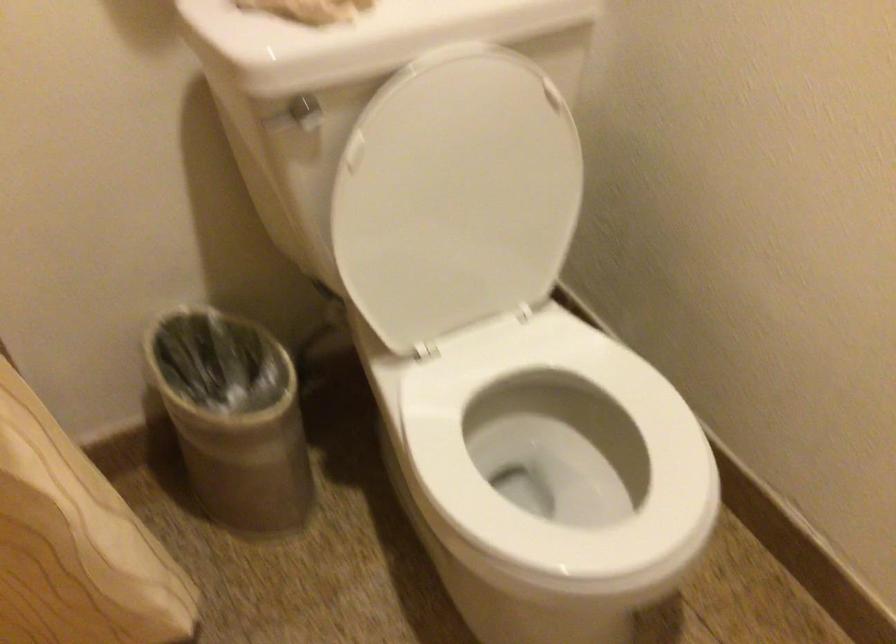
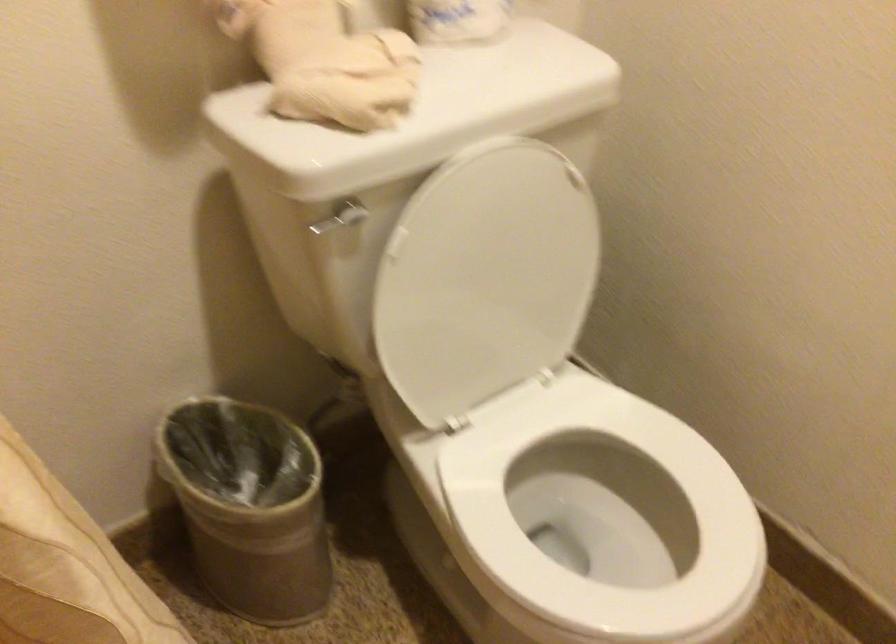
Question: The camera is either moving clockwise (left) or counter-clockwise (right) around the object. The first image is from the beginning of the video and the second image is from the end. Is the camera moving left or right when shooting the video?

Choices:
 (A) Left
 (B) Right

Answer: (A)